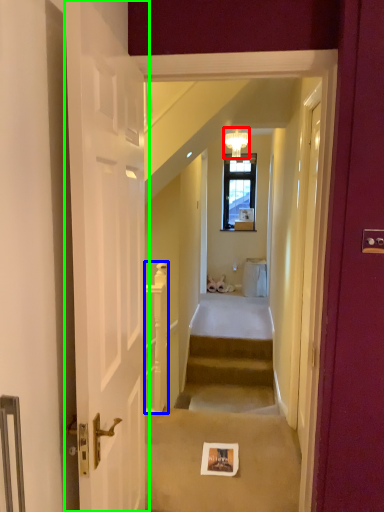
Question: Which object is the farthest from light fixture (highlighted by a red box)? Choose among these: balustrade (highlighted by a blue box) or door (highlighted by a green box).

Choices:
 (A) balustrade
 (B) door

Answer: (B)